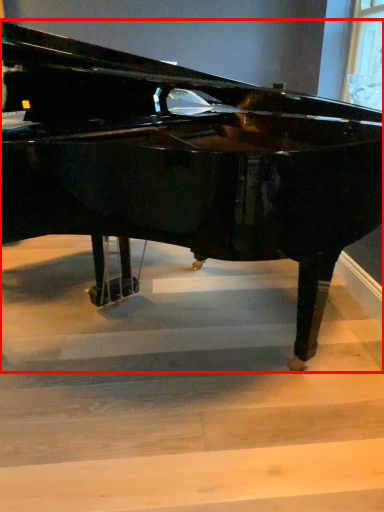
Question: From the image's perspective, what is the correct spatial relationship of piano (annotated by the red box) in relation to stairwell?

Choices:
 (A) above
 (B) below

Answer: (A)